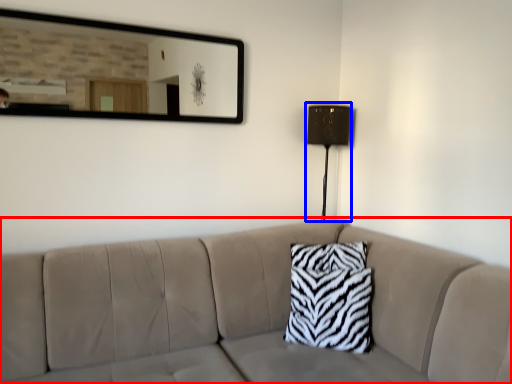
Question: Which of the following is the farthest to the observer, studio couch (highlighted by a red box) or table lamp (highlighted by a blue box)?

Choices:
 (A) studio couch
 (B) table lamp

Answer: (B)